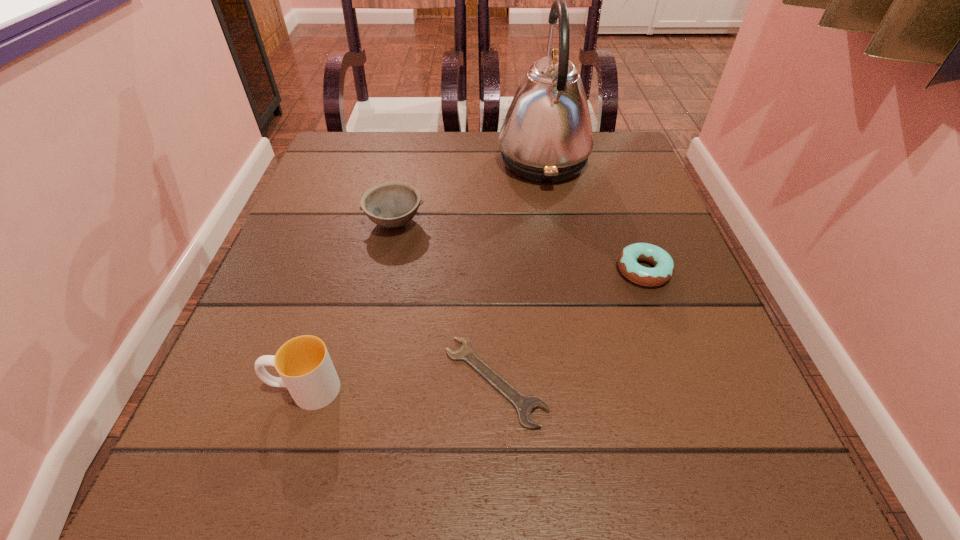
Where is `empty space between the wrench and the doughnut`? The width and height of the screenshot is (960, 540). empty space between the wrench and the doughnut is located at coordinates (569, 326).

What are the coordinates of `vacant space in between the shortest object and the fourth shortest object` in the screenshot? It's located at (399, 385).

Locate an element on the screen. This screenshot has width=960, height=540. free spot between the cup and the bowl is located at coordinates (349, 306).

Identify the location of free space between the cup and the third tallest object. (349, 306).

You are a GUI agent. You are given a task and a screenshot of the screen. Output one action in this format:
    pyautogui.click(x=<x>, y=<y>)
    Task: Click on the empty location between the fourth tallest object and the second tallest object
    
    Given the screenshot: What is the action you would take?
    pyautogui.click(x=474, y=330)

I want to click on vacant space in between the doughnut and the shortest object, so click(569, 326).

Find the location of a particular element. The width and height of the screenshot is (960, 540). vacant space that is in between the third tallest object and the cup is located at coordinates (349, 306).

Identify the location of vacant space that is in between the third farthest object and the bowl. This screenshot has height=540, width=960. point(519,246).

You are a GUI agent. You are given a task and a screenshot of the screen. Output one action in this format:
    pyautogui.click(x=<x>, y=<y>)
    Task: Click on the object that ranks as the closest to the cup
    This screenshot has height=540, width=960.
    Given the screenshot: What is the action you would take?
    524,405

Identify which object is located as the fourth nearest to the second farthest object. Please provide its 2D coordinates. Your answer should be formatted as a tuple, i.e. [(x, y)], where the tuple contains the x and y coordinates of a point satisfying the conditions above.

[(664, 268)]